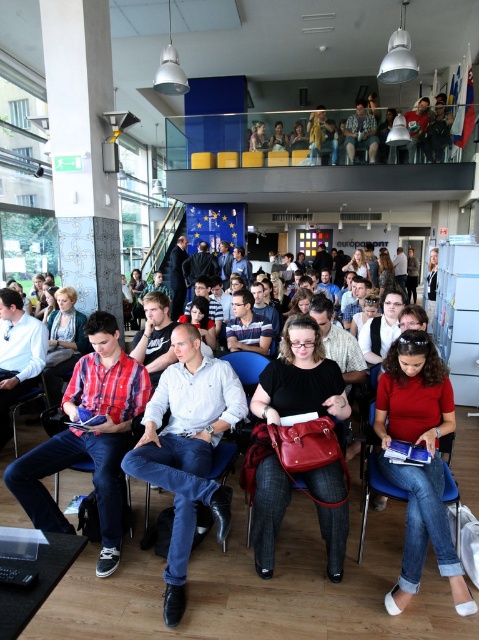
You are an attendee at this event and need to retrieve your matte black bag at center. You are currently standing near the matte red blouse at lower right. Can you directly reach your bag without moving around other attendees?

The matte black bag at center is further to the viewer than the matte red blouse at lower right, meaning it is closer to you. Since it is closer, you can likely reach it directly without needing to move around others.

In the scene shown: You are organizing a presentation and need to move a projector from the matte black bag at center to the nearest electrical outlet. The outlet is located 8 feet away from your current position. Can you reach the outlet without moving the bag?

The matte black bag at center is 7.65 feet away from the outlet, so yes, you can reach the outlet without moving the bag since it is within the 8 feet distance.

You are an event organizer who needs to ensure that the matte black jacket at upper center is not left unattended. Since you can only move the blue fabric chair at lower right, what action should you take to secure the jacket?

A: The matte black jacket at upper center is positioned over the blue fabric chair at lower right. To secure the jacket, you should move the blue fabric chair at lower right to a position where the jacket can be placed safely, such as under it or on a nearby hanger.